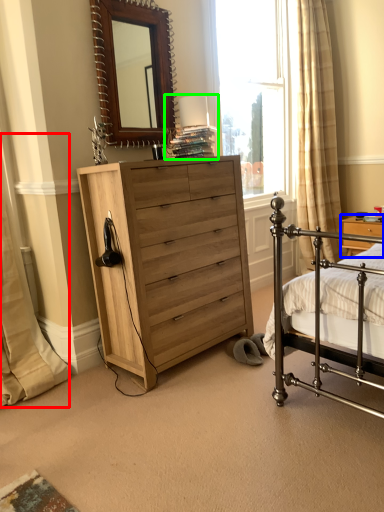
Question: Which is farther away from curtain (highlighted by a red box)? nightstand (highlighted by a blue box) or table lamp (highlighted by a green box)?

Choices:
 (A) nightstand
 (B) table lamp

Answer: (A)